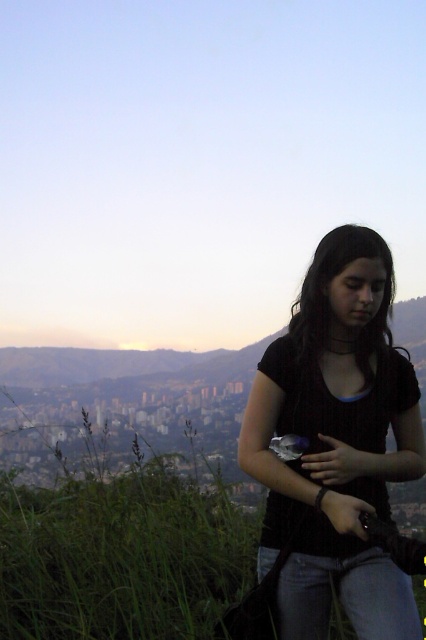
You are an outdoor photographer setting up your equipment. You have a black knitted sweater at center and green grass at lower left in your viewfinder. Which object occupies more space in the frame?

The green grass at lower left occupies more space in the frame because the black knitted sweater at center has a smaller size compared to it.